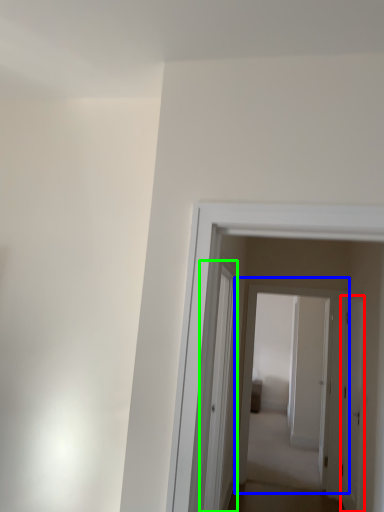
Question: Which is nearer to the door (highlighted by a red box)? door (highlighted by a blue box) or glass door (highlighted by a green box).

Choices:
 (A) door
 (B) glass door

Answer: (A)